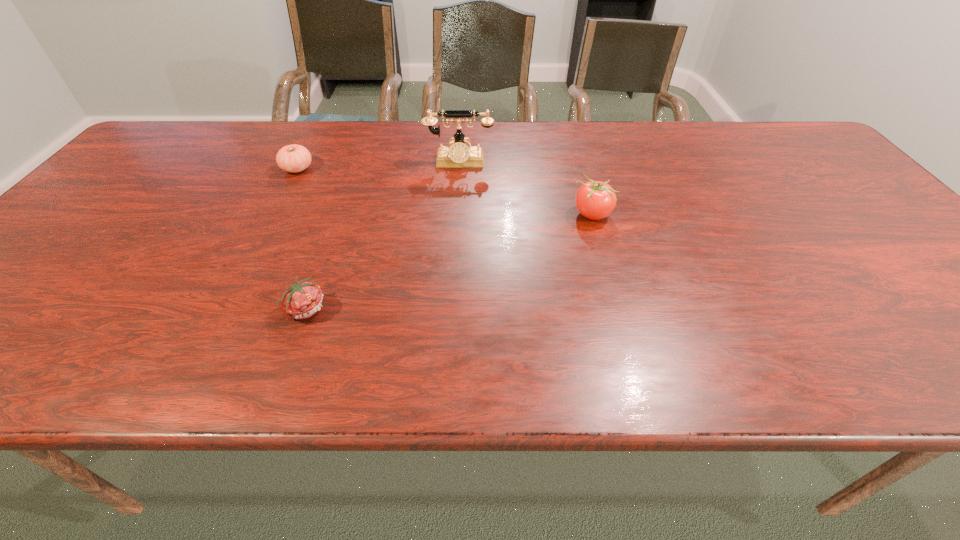
At what (x,y) coordinates should I click in order to perform the action: click on the second object from right to left. Please return your answer as a coordinate pair (x, y). Looking at the image, I should click on (458, 155).

The image size is (960, 540). In order to click on the tallest object in this screenshot , I will do `click(458, 155)`.

At what (x,y) coordinates should I click in order to perform the action: click on the tallest tomato. Please return your answer as a coordinate pair (x, y). The width and height of the screenshot is (960, 540). Looking at the image, I should click on (595, 200).

I want to click on the third farthest object, so click(595, 200).

Image resolution: width=960 pixels, height=540 pixels. Identify the location of the leftmost object. (294, 158).

What are the coordinates of `the farthest tomato` in the screenshot? It's located at (294, 158).

Locate an element on the screen. Image resolution: width=960 pixels, height=540 pixels. the second tomato from left to right is located at coordinates (301, 300).

Where is `the third object from right to left`? This screenshot has width=960, height=540. the third object from right to left is located at coordinates (301, 300).

Locate an element on the screen. vacant space located on the dial of the telephone is located at coordinates (453, 257).

Image resolution: width=960 pixels, height=540 pixels. What are the coordinates of `vacant area situated 0.140m on the back of the second farthest tomato` in the screenshot? It's located at (580, 172).